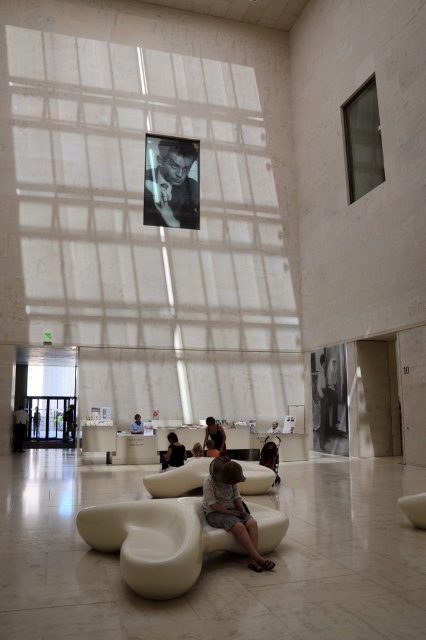
You are a visitor in the museum and want to sit down. You see the matte beige couch at center and the light brown wooden chair at center. Which one has more space to accommodate a larger person?

The matte beige couch at center is larger in size than the light brown wooden chair at center, so it can accommodate a larger person better.

You are standing at the entrance of the museum and want to sit down. You see the matte beige couch at center and the light brown wooden chair at center. Which one is higher up from the floor?

The matte beige couch at center is located above the light brown wooden chair at center, so the matte beige couch at center is higher up from the floor.